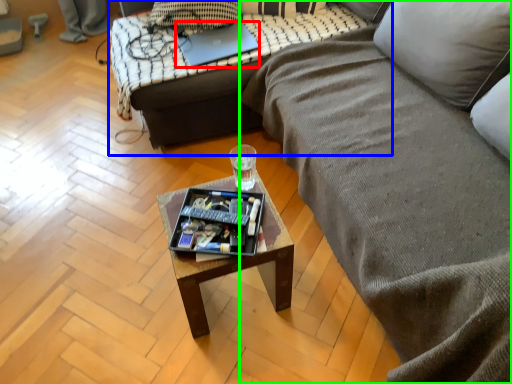
Question: Estimate the real-world distances between objects in this image. Which object is farther from laptop (highlighted by a red box), studio couch (highlighted by a blue box) or studio couch (highlighted by a green box)?

Choices:
 (A) studio couch
 (B) studio couch

Answer: (B)